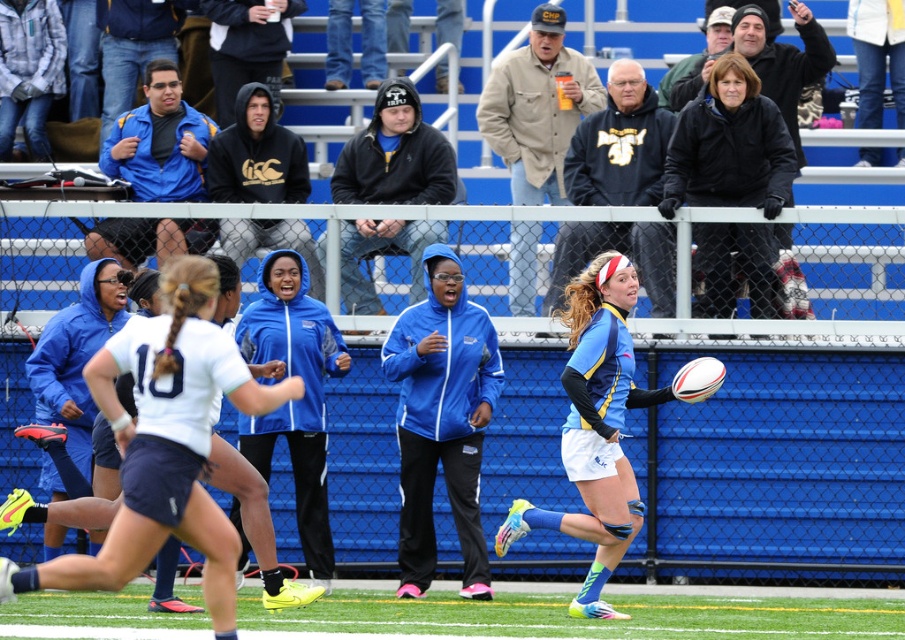
Does white matte jersey at center appear on the left side of black matte jacket at upper right?

Indeed, white matte jersey at center is positioned on the left side of black matte jacket at upper right.

Is white matte jersey at center positioned in front of black matte jacket at upper right?

Yes, white matte jersey at center is in front of black matte jacket at upper right.

Is point (137, 566) farther from camera compared to point (756, 141)?

No.

I want to click on white matte jersey at center, so 165,442.

Does white matte jersey at center appear over light blue jersey at center?

Actually, white matte jersey at center is below light blue jersey at center.

Does white matte jersey at center lie in front of light blue jersey at center?

Yes.

The width and height of the screenshot is (905, 640). Find the location of `white matte jersey at center`. white matte jersey at center is located at coordinates (165, 442).

Between light blue jersey at center and black matte jacket at upper right, which one appears on the left side from the viewer's perspective?

light blue jersey at center

The height and width of the screenshot is (640, 905). I want to click on light blue jersey at center, so click(595, 428).

You are a GUI agent. You are given a task and a screenshot of the screen. Output one action in this format:
    pyautogui.click(x=<x>, y=<y>)
    Task: Click on the light blue jersey at center
    This screenshot has width=905, height=640.
    Given the screenshot: What is the action you would take?
    pyautogui.click(x=595, y=428)